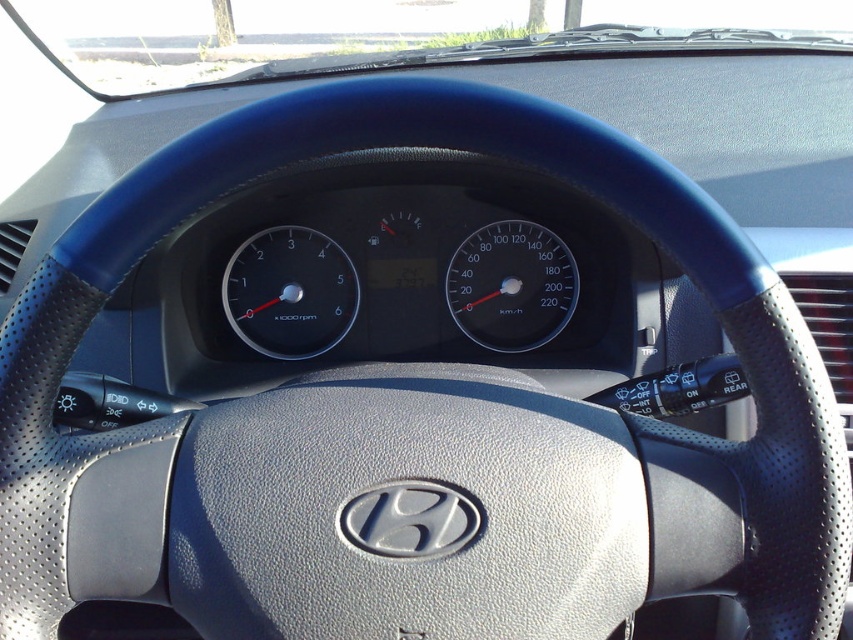
You are sitting in the driver seat of the car and looking at the dashboard. There are two points marked on the dashboard. The first point is at coordinates point (242, 332) and the second point is at coordinates point (550, 253). Which point do you think is closer to you?

Point (242, 332) is closer to the viewer than point (550, 253).

Based on the photo, you are driving a car and want to check your speed. You notice two speedometers on the dashboard. Which one is taller, the black leather speedometer at center or the transparent glass speedometer at center?

The black leather speedometer at center is taller than the transparent glass speedometer at center according to the description.